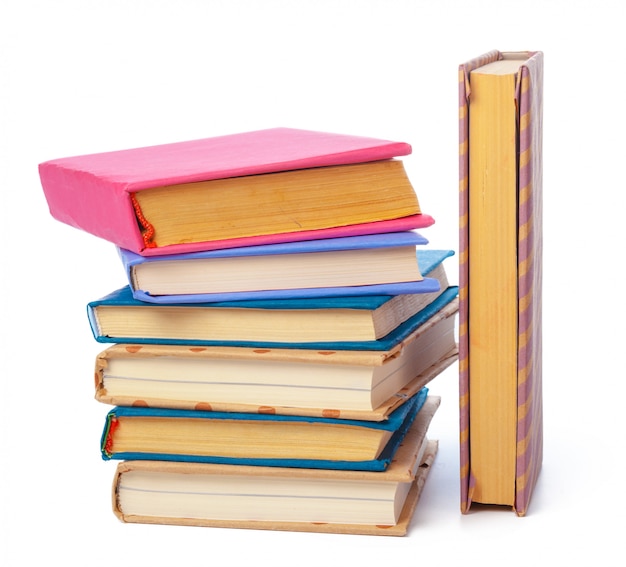
This screenshot has height=567, width=626. What are the coordinates of `stacked books` in the screenshot? It's located at (208, 211), (205, 270), (207, 319), (217, 368), (223, 442), (233, 497).